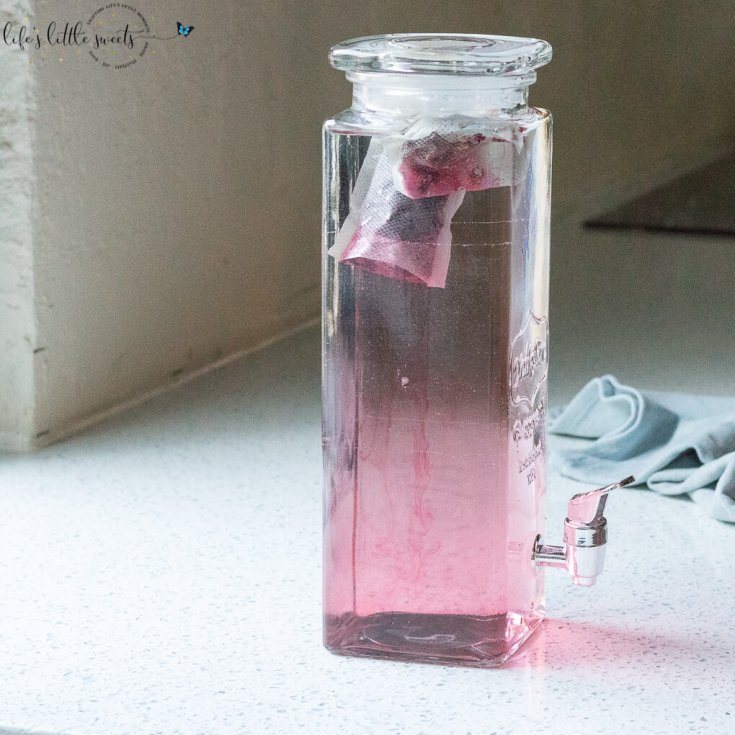
The width and height of the screenshot is (735, 735). I want to click on light blue counter top, so click(x=147, y=581).